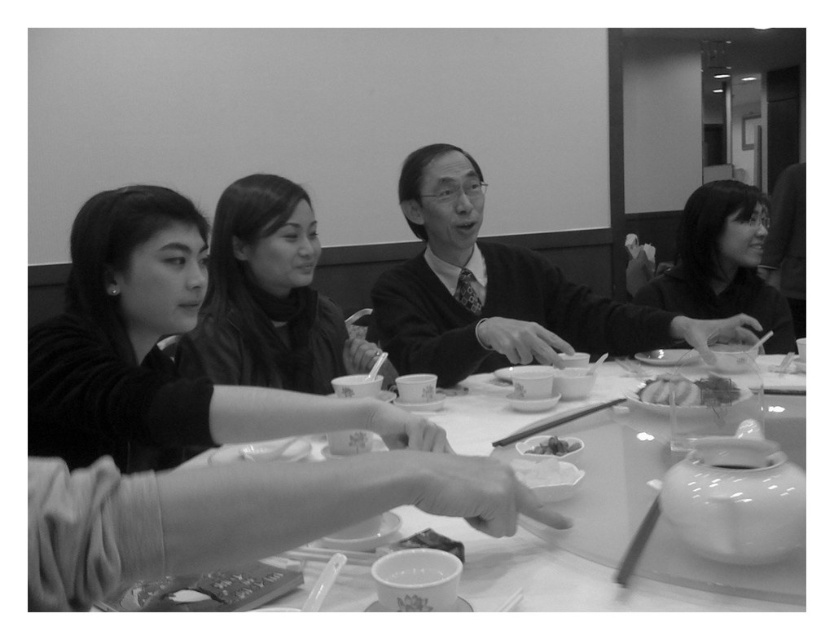
Question: Can you confirm if smooth black hair at right is positioned to the right of smooth wooden chopsticks at center?

Choices:
 (A) yes
 (B) no

Answer: (A)

Question: Is the position of knitted sweater at center less distant than that of smooth plastic chopstick at lower center?

Choices:
 (A) no
 (B) yes

Answer: (A)

Question: Which point is farther to the camera?

Choices:
 (A) (667, 380)
 (B) (686, 257)

Answer: (B)

Question: Which object is positioned farthest from the smooth wooden chopsticks at center?

Choices:
 (A) smooth black hair at right
 (B) white glossy table at center

Answer: (A)

Question: Does white glossy table at center have a smaller size compared to smooth black hair at center?

Choices:
 (A) no
 (B) yes

Answer: (A)

Question: Estimate the real-world distances between objects in this image. Which object is farther from the white glossy table at center?

Choices:
 (A) smooth black hair at center
 (B) smooth white rice at center
 (C) knitted sweater at center

Answer: (A)